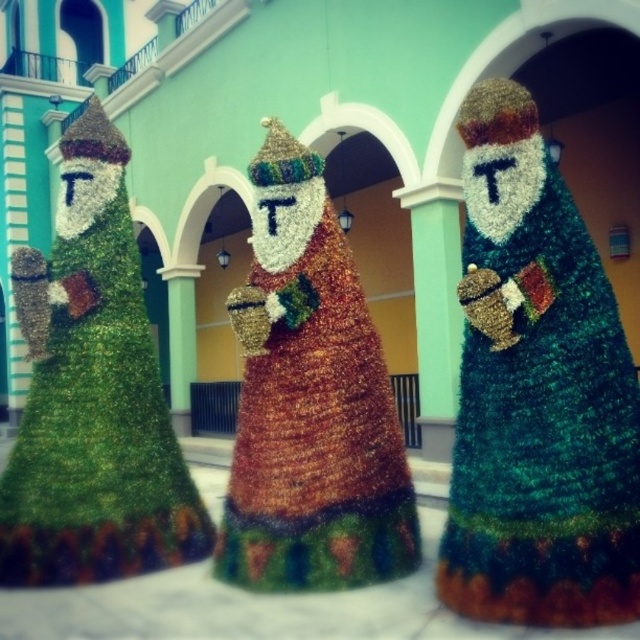
Question: Does green textured santa claus at center appear on the right side of gold textured santa claus at center?

Choices:
 (A) no
 (B) yes

Answer: (B)

Question: Which point is farther to the camera?

Choices:
 (A) green textured santa claus at center
 (B) gold textured santa claus at center

Answer: (B)

Question: Is green textured santa claus at center above gold textured santa claus at center?

Choices:
 (A) yes
 (B) no

Answer: (A)

Question: Does green textured santa claus at center come in front of gold textured santa claus at center?

Choices:
 (A) yes
 (B) no

Answer: (A)